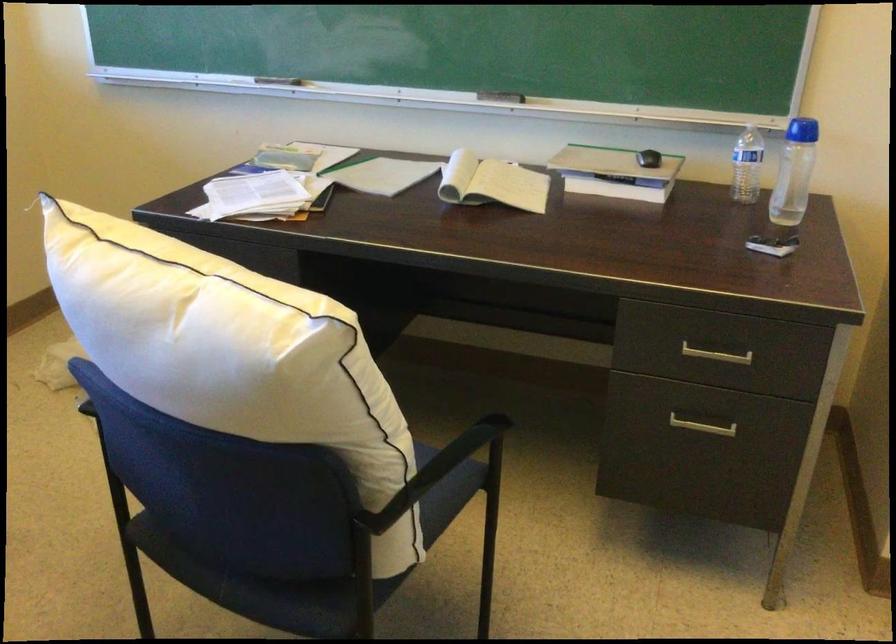
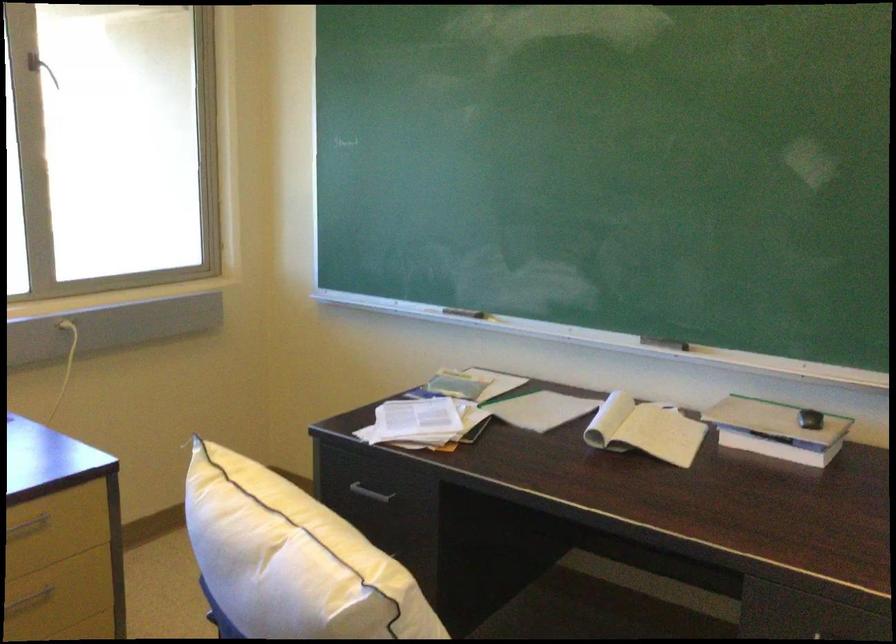
Where in the second image is the point corresponding to (503,100) from the first image?

(664, 343)